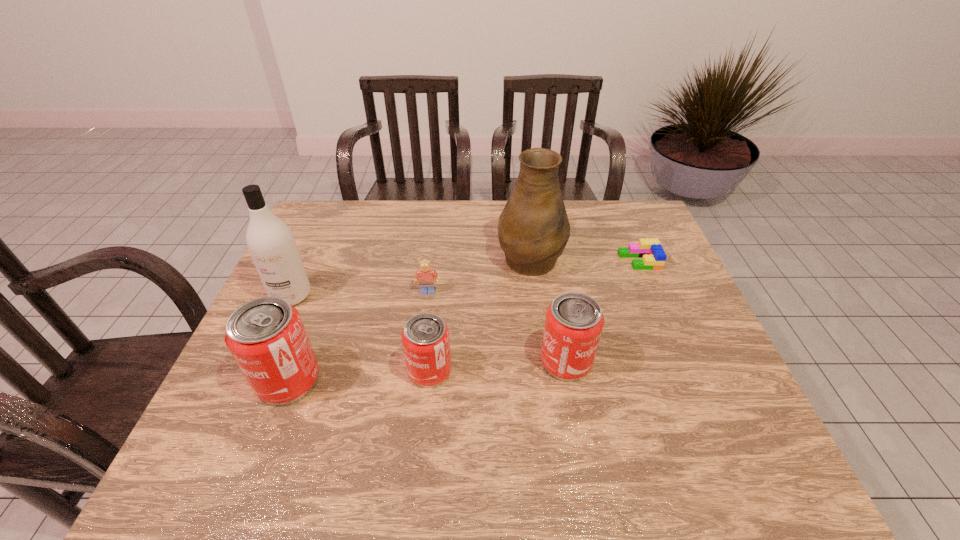
You are a GUI agent. You are given a task and a screenshot of the screen. Output one action in this format:
    pyautogui.click(x=<x>, y=<y>)
    Task: Click on the leftmost can
    This screenshot has width=960, height=540.
    Given the screenshot: What is the action you would take?
    pyautogui.click(x=266, y=336)

I want to click on the shortest can, so click(x=425, y=337).

Where is `the second can from left to right`? the second can from left to right is located at coordinates (425, 337).

I want to click on the fourth shortest object, so click(x=574, y=321).

Where is `the rightmost can`? Image resolution: width=960 pixels, height=540 pixels. the rightmost can is located at coordinates (574, 321).

The width and height of the screenshot is (960, 540). Find the location of `pitcher`. pitcher is located at coordinates (533, 229).

Image resolution: width=960 pixels, height=540 pixels. Find the location of `shampoo`. shampoo is located at coordinates (271, 244).

Identify the location of the taller Lego. [426, 275].

The height and width of the screenshot is (540, 960). I want to click on the second shortest object, so click(426, 275).

Locate an element on the screen. the shorter Lego is located at coordinates (651, 251).